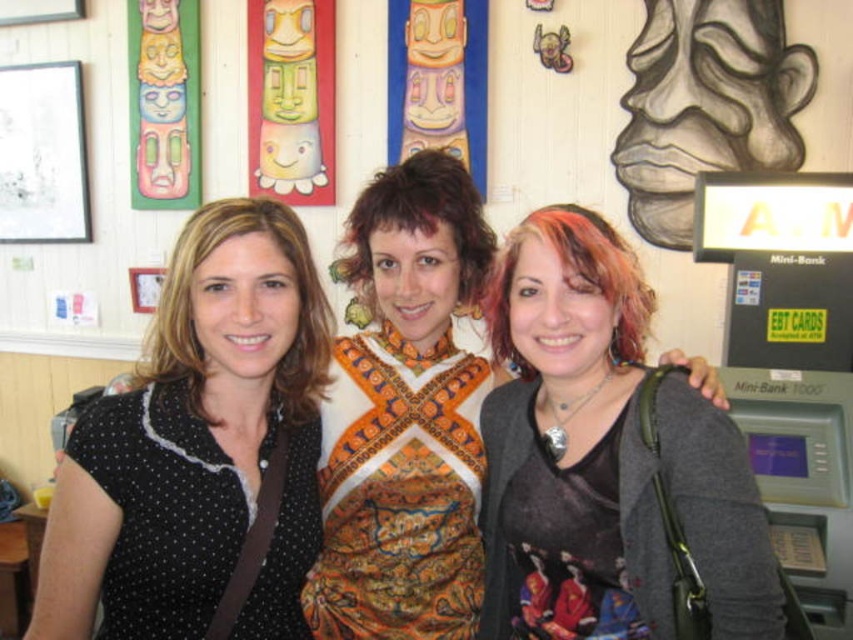
Is matte black purse at center smaller than black dotted shirt at left?

No, matte black purse at center is not smaller than black dotted shirt at left.

Is matte black purse at center further to camera compared to black dotted shirt at left?

Yes, it is behind black dotted shirt at left.

The image size is (853, 640). What do you see at coordinates (570, 442) in the screenshot?
I see `matte black purse at center` at bounding box center [570, 442].

Identify the location of matte black purse at center. (570, 442).

Is black dotted shirt at left to the left of printed fabric scarf at center from the viewer's perspective?

Yes, black dotted shirt at left is to the left of printed fabric scarf at center.

Measure the distance between point (297, 296) and camera.

Point (297, 296) is 1.09 meters from camera.

At what (x,y) coordinates should I click in order to perform the action: click on black dotted shirt at left. Please return your answer as a coordinate pair (x, y). This screenshot has width=853, height=640. Looking at the image, I should click on (196, 445).

Measure the distance between point (x=618, y=627) and camera.

Point (x=618, y=627) is 1.12 meters from camera.

Who is taller, matte black purse at center or printed fabric scarf at center?

Standing taller between the two is printed fabric scarf at center.

Describe the element at coordinates (570, 442) in the screenshot. I see `matte black purse at center` at that location.

Where is `matte black purse at center`? matte black purse at center is located at coordinates (570, 442).